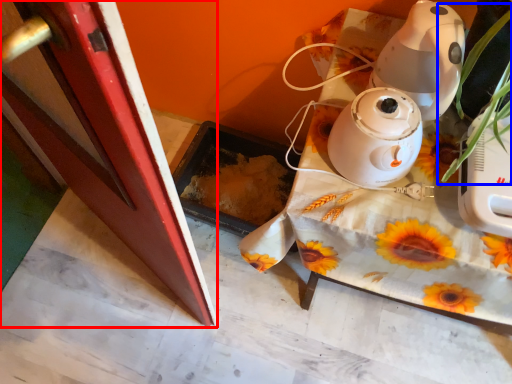
Question: Which object is further to the camera taking this photo, screen door (highlighted by a red box) or plant (highlighted by a blue box)?

Choices:
 (A) screen door
 (B) plant

Answer: (A)